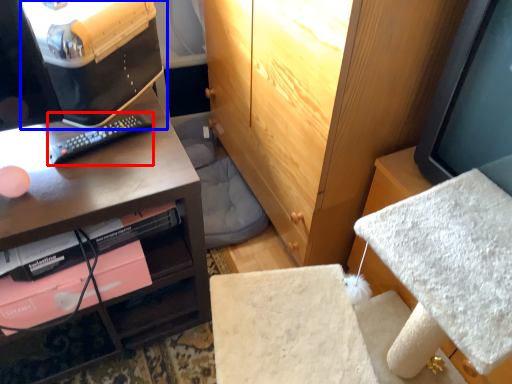
Question: Which object appears closest to the camera in this image, remote (highlighted by a red box) or desktop computer (highlighted by a blue box)?

Choices:
 (A) remote
 (B) desktop computer

Answer: (B)